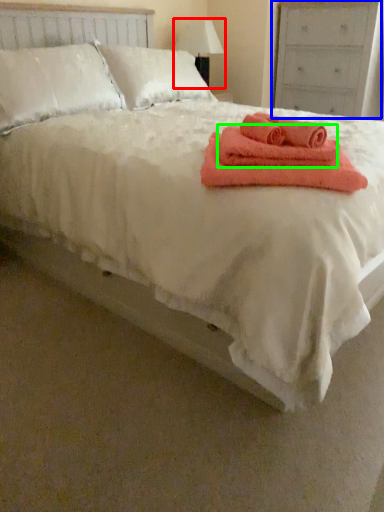
Question: Based on their relative distances, which object is farther from table lamp (highlighted by a red box)? Choose from dresser (highlighted by a blue box) and bath towel (highlighted by a green box).

Choices:
 (A) dresser
 (B) bath towel

Answer: (B)